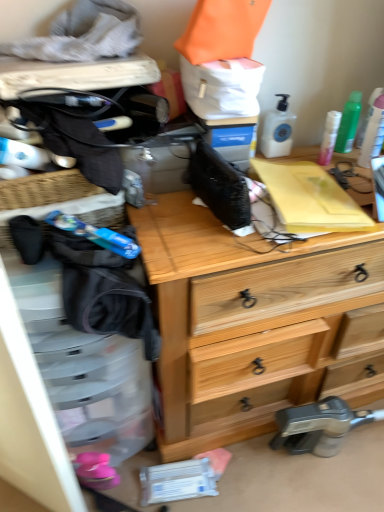
Question: Looking at the image, does pink matte lotion at upper right, marked as the second toiletry in a left-to-right arrangement, seem bigger or smaller compared to wooden chest of drawers at center?

Choices:
 (A) small
 (B) big

Answer: (A)

Question: Is pink matte lotion at upper right, the 3th toiletry viewed from the right, inside or outside of wooden chest of drawers at center?

Choices:
 (A) inside
 (B) outside

Answer: (B)

Question: Which is farther from the wooden chest of drawers at center?

Choices:
 (A) pink matte lotion at upper right, marked as the second toiletry in a left-to-right arrangement
 (B) green matte spray can at upper right, the 3th toiletry from the left
 (C) green plastic spray can at upper right, marked as the 1th toiletry in a right-to-left arrangement
 (D) white plastic pump bottle at upper right, arranged as the 4th toiletry when viewed from the right

Answer: (B)

Question: Based on their relative distances, which object is farther from the green plastic spray can at upper right, acting as the fourth toiletry starting from the left?

Choices:
 (A) green matte spray can at upper right, the 3th toiletry from the left
 (B) white plastic pump bottle at upper right, arranged as the 4th toiletry when viewed from the right
 (C) pink matte lotion at upper right, marked as the second toiletry in a left-to-right arrangement
 (D) wooden chest of drawers at center

Answer: (D)